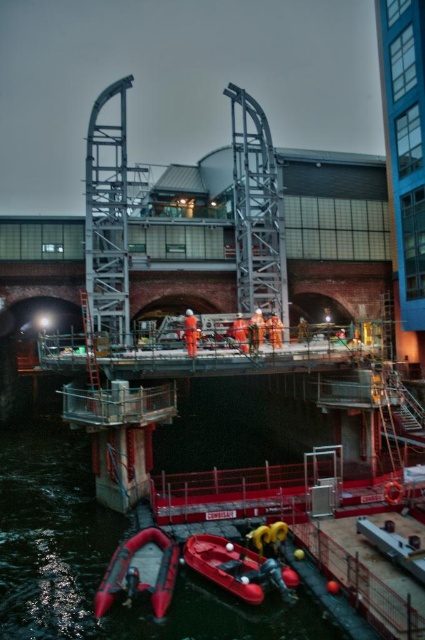
You are a construction worker who needs to move equipment from the rubberized red inflatable boat at lower left to the rubberized red inflatable boat at lower center. Which boat should you place the equipment on first to ensure it reaches the destination safely?

You should place the equipment on the rubberized red inflatable boat at lower center first because it is positioned above the rubberized red inflatable boat at lower left, making it easier to transfer items directly without needing to move around obstacles.